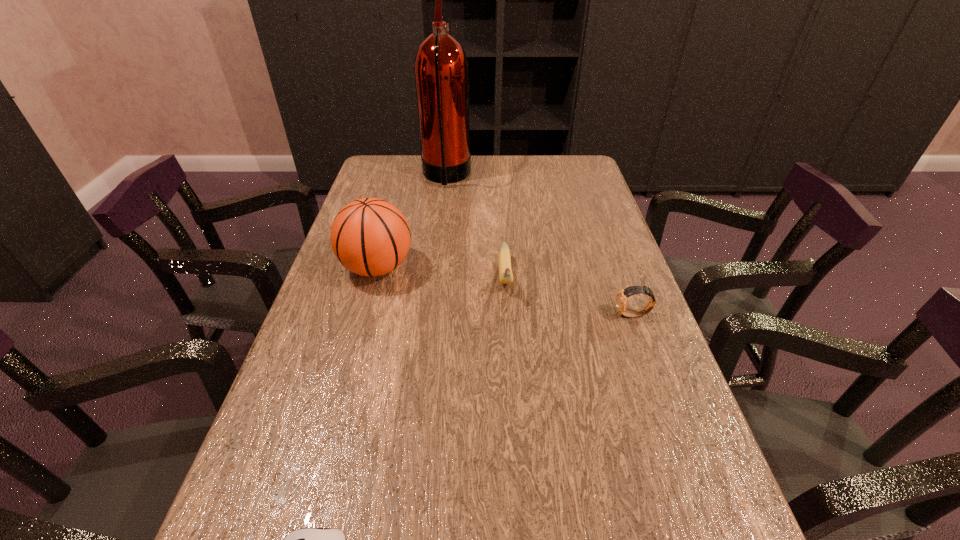
Where is `vacant area that lies between the second tallest object and the banana`? The width and height of the screenshot is (960, 540). vacant area that lies between the second tallest object and the banana is located at coordinates (442, 273).

This screenshot has width=960, height=540. Find the location of `free space between the second object from right to left and the rightmost object`. free space between the second object from right to left and the rightmost object is located at coordinates (569, 296).

At what (x,y) coordinates should I click in order to perform the action: click on free space between the rightmost object and the fourth shortest object. Please return your answer as a coordinate pair (x, y). This screenshot has height=540, width=960. Looking at the image, I should click on (505, 291).

Where is `empty space that is in between the fourth shortest object and the farthest object`? empty space that is in between the fourth shortest object and the farthest object is located at coordinates (412, 222).

Locate an element on the screen. free space between the basketball and the banana is located at coordinates (442, 273).

The image size is (960, 540). I want to click on empty space that is in between the fourth object from left to right and the rightmost object, so click(569, 296).

Identify the location of free point between the farthest object and the fourth object from left to right. (476, 227).

Choose which object is the nearest neighbor to the second object from right to left. Please provide its 2D coordinates. Your answer should be formatted as a tuple, i.e. [(x, y)], where the tuple contains the x and y coordinates of a point satisfying the conditions above.

[(370, 237)]

Locate which object ranks third in proximity to the tallest object. Please provide its 2D coordinates. Your answer should be formatted as a tuple, i.e. [(x, y)], where the tuple contains the x and y coordinates of a point satisfying the conditions above.

[(621, 298)]